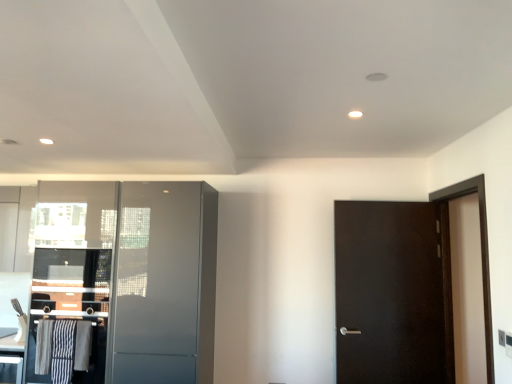
Question: Would you say dark wood screen door at right, acting as the 1th screen door starting from the right, contains metallic silver cabinet at left, the 2th cabinetry positioned from the top?

Choices:
 (A) yes
 (B) no

Answer: (B)

Question: From the image's perspective, is dark wood screen door at right, acting as the 1th screen door starting from the right, under metallic silver cabinet at left, the 2th cabinetry positioned from the top?

Choices:
 (A) no
 (B) yes

Answer: (A)

Question: Is dark wood screen door at right, which is the 2th screen door from left to right, positioned beyond the bounds of metallic silver cabinet at left, the 2th cabinetry positioned from the top?

Choices:
 (A) yes
 (B) no

Answer: (A)

Question: Is dark wood screen door at right, which is the 2th screen door from left to right, aimed at metallic silver cabinet at left, which is the 1th cabinetry in bottom-to-top order?

Choices:
 (A) yes
 (B) no

Answer: (A)

Question: Does dark wood screen door at right, acting as the 1th screen door starting from the right, have a greater height compared to metallic silver cabinet at left, which is the 1th cabinetry in bottom-to-top order?

Choices:
 (A) yes
 (B) no

Answer: (A)

Question: Is the position of dark wood screen door at right, which is the 2th screen door from left to right, more distant than that of metallic silver cabinet at left, the 2th cabinetry positioned from the top?

Choices:
 (A) yes
 (B) no

Answer: (B)

Question: Is dark wood screen door at right, acting as the 1th screen door starting from the right, located outside satin gray cabinet at left, which is counted as the second screen door, starting from the right?

Choices:
 (A) no
 (B) yes

Answer: (B)

Question: Can you confirm if dark wood screen door at right, which is the 2th screen door from left to right, is taller than satin gray cabinet at left, which is counted as the second screen door, starting from the right?

Choices:
 (A) no
 (B) yes

Answer: (A)

Question: Are dark wood screen door at right, acting as the 1th screen door starting from the right, and satin gray cabinet at left, which is counted as the second screen door, starting from the right, beside each other?

Choices:
 (A) no
 (B) yes

Answer: (A)

Question: Is dark wood screen door at right, acting as the 1th screen door starting from the right, closer to the viewer compared to satin gray cabinet at left, which is counted as the second screen door, starting from the right?

Choices:
 (A) no
 (B) yes

Answer: (B)

Question: Is the position of dark wood screen door at right, which is the 2th screen door from left to right, more distant than that of satin gray cabinet at left, which is counted as the second screen door, starting from the right?

Choices:
 (A) yes
 (B) no

Answer: (B)

Question: From the image's perspective, would you say dark wood screen door at right, which is the 2th screen door from left to right, is positioned over satin gray cabinet at left, which is counted as the second screen door, starting from the right?

Choices:
 (A) no
 (B) yes

Answer: (B)

Question: Is dark wood screen door at right, acting as the 1th screen door starting from the right, next to striped fabric laundry at lower left?

Choices:
 (A) yes
 (B) no

Answer: (B)